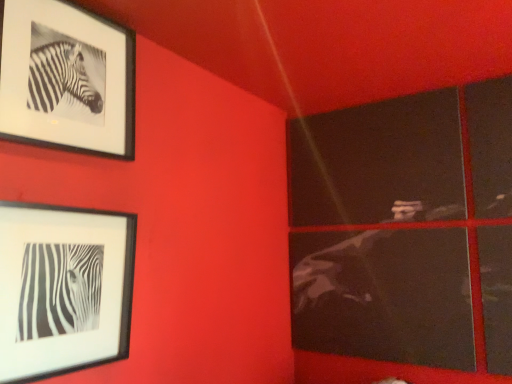
Question: Is point (52, 369) closer or farther from the camera than point (45, 66)?

Choices:
 (A) closer
 (B) farther

Answer: (A)

Question: Do you think black matte picture frame at lower left, the 2th picture frame from the top, is within black matte picture frame at upper left, which is counted as the 1th picture frame, starting from the top, or outside of it?

Choices:
 (A) outside
 (B) inside

Answer: (A)

Question: Based on their sizes in the image, would you say black matte picture frame at lower left, the 2th picture frame from the top, is bigger or smaller than black matte picture frame at upper left, which is counted as the 1th picture frame, starting from the top?

Choices:
 (A) big
 (B) small

Answer: (A)

Question: From a real-world perspective, is black matte picture frame at upper left, arranged as the 2th picture frame when ordered from the bottom, above or below black matte picture frame at lower left, placed as the first picture frame when sorted from bottom to top?

Choices:
 (A) below
 (B) above

Answer: (B)

Question: Choose the correct answer: Is black matte picture frame at upper left, which is counted as the 1th picture frame, starting from the top, inside black matte picture frame at lower left, placed as the first picture frame when sorted from bottom to top, or outside it?

Choices:
 (A) outside
 (B) inside

Answer: (A)

Question: Does point (45, 56) appear closer or farther from the camera than point (77, 317)?

Choices:
 (A) farther
 (B) closer

Answer: (B)

Question: Considering their positions, is black matte picture frame at upper left, which is counted as the 1th picture frame, starting from the top, located in front of or behind black matte picture frame at lower left, the 2th picture frame from the top?

Choices:
 (A) behind
 (B) front

Answer: (A)